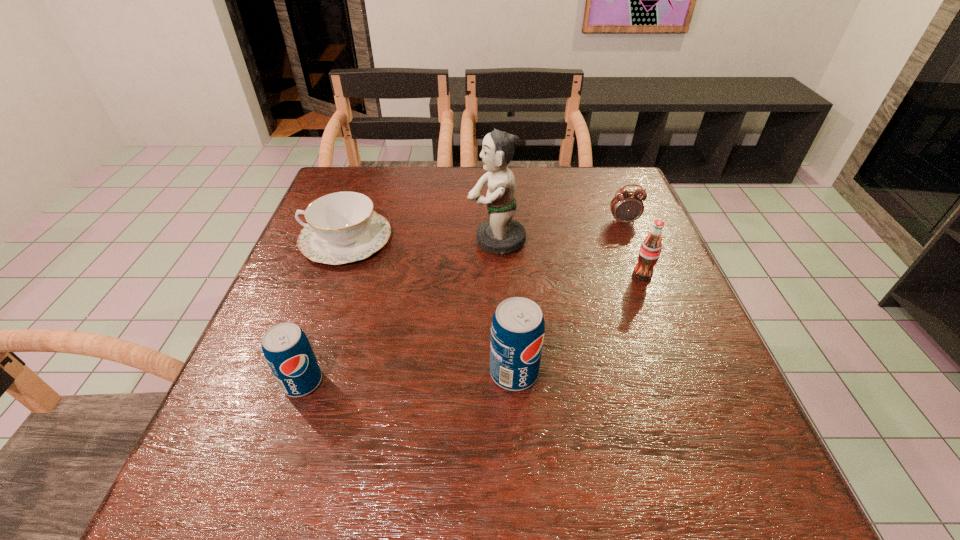
What are the coordinates of `free point between the rightmost soda and the chinaware` in the screenshot? It's located at (494, 257).

You are a GUI agent. You are given a task and a screenshot of the screen. Output one action in this format:
    pyautogui.click(x=<x>, y=<y>)
    Task: Click on the empty space that is in between the rightmost soda and the second soda from left to right
    The image size is (960, 540).
    Given the screenshot: What is the action you would take?
    pyautogui.click(x=578, y=323)

I want to click on the fourth closest object to the second soda from left to right, so click(342, 227).

Locate which object ranks fourth in proximity to the figurine. Please provide its 2D coordinates. Your answer should be formatted as a tuple, i.e. [(x, y)], where the tuple contains the x and y coordinates of a point satisfying the conditions above.

[(517, 331)]

Identify which soda is the closest to the farthest soda. Please provide its 2D coordinates. Your answer should be formatted as a tuple, i.e. [(x, y)], where the tuple contains the x and y coordinates of a point satisfying the conditions above.

[(517, 331)]

Identify the location of soda identified as the second closest to the farthest soda. The image size is (960, 540). (286, 348).

This screenshot has height=540, width=960. I want to click on free space that satisfies the following two spatial constraints: 1. on the handle side of the shortest object; 2. on the right side of the rightmost soda, so click(334, 275).

Image resolution: width=960 pixels, height=540 pixels. What are the coordinates of `free space that satisfies the following two spatial constraints: 1. on the handle side of the chinaware; 2. on the left side of the farthest soda` in the screenshot? It's located at (334, 275).

Locate an element on the screen. free space in the image that satisfies the following two spatial constraints: 1. on the face of the alarm clock; 2. on the front-facing side of the tallest object is located at coordinates (631, 240).

This screenshot has width=960, height=540. Identify the location of vacant region that satisfies the following two spatial constraints: 1. on the back side of the leftmost soda; 2. on the handle side of the shortest object. (351, 239).